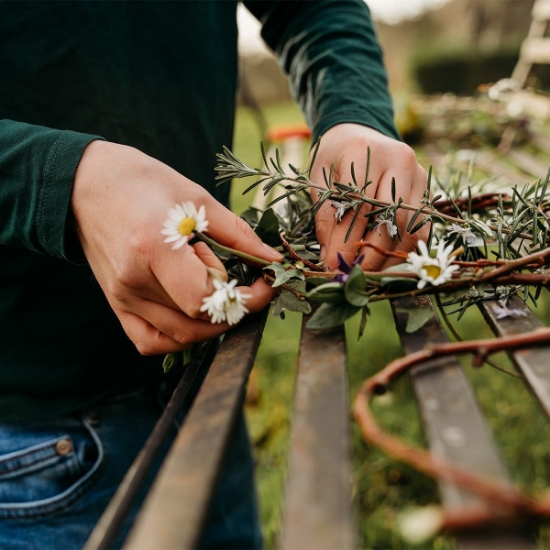
Locate an element on the screen. This screenshot has height=550, width=550. rack is located at coordinates (318, 434).